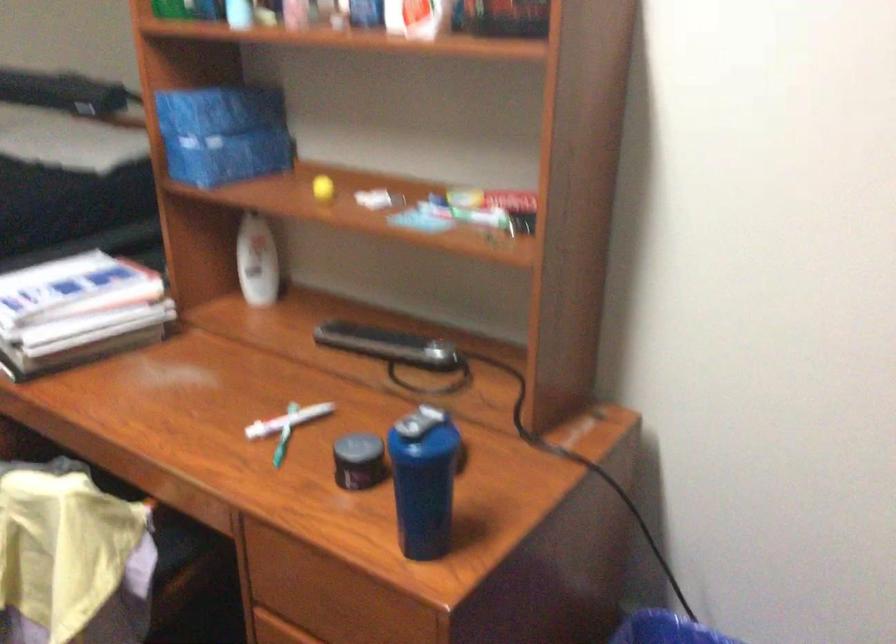
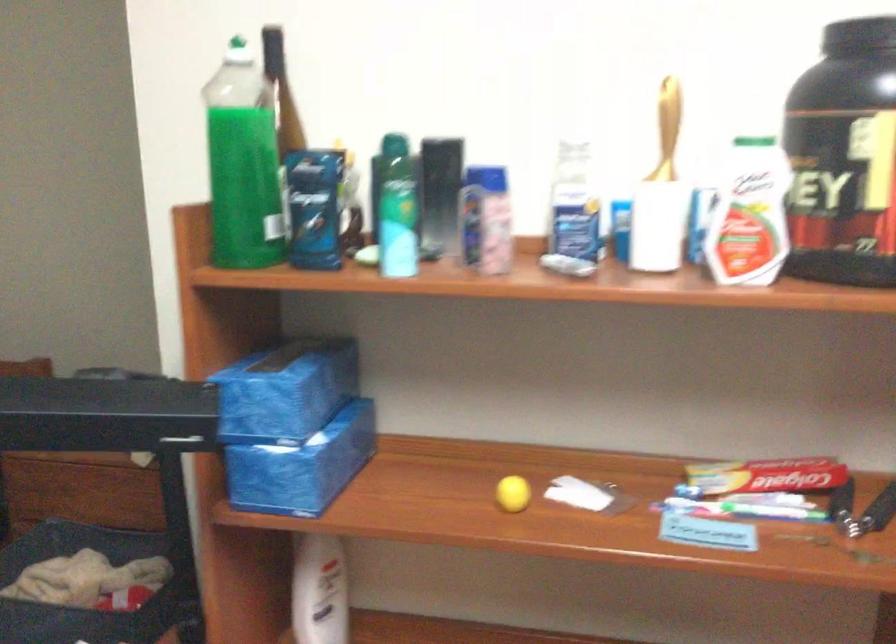
Locate, in the second image, the point that corresponds to (x=194, y=158) in the first image.

(288, 478)